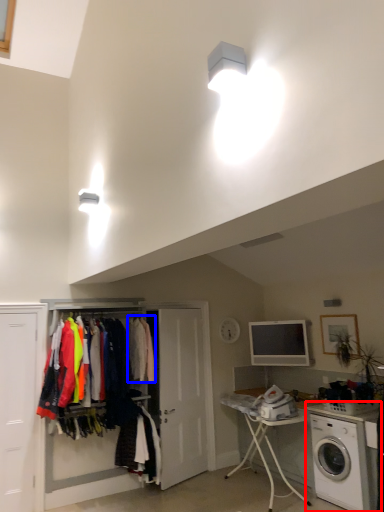
Question: Which object appears closest to the camera in this image, washing machine (highlighted by a red box) or clothing (highlighted by a blue box)?

Choices:
 (A) washing machine
 (B) clothing

Answer: (A)